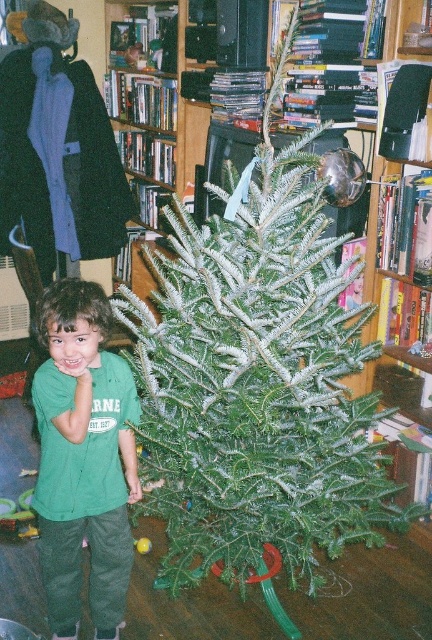
You are standing in front of the Christmas tree and want to reach the point at coordinates point [181,545]. If you can stretch your arm 1.5 meters, will you be able to touch it?

The point at coordinates point [181,545] is 1.80 meters away from you. Since your arm can only stretch 1.5 meters, you cannot reach it.

You are a photographer setting up for a family photo. The green textured christmas tree at center and the green cotton shirt at center are part of the scene. How far apart are these two items in inches?

The green textured christmas tree at center and green cotton shirt at center are 14.31 inches apart.